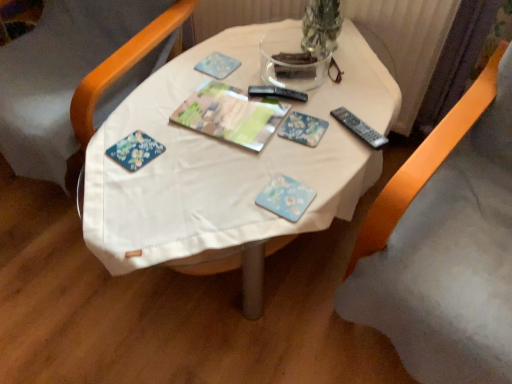
Where is `vacant area on the back side of blue floral coaster at center, which is the second paperback book from top to bottom`? This screenshot has height=384, width=512. vacant area on the back side of blue floral coaster at center, which is the second paperback book from top to bottom is located at coordinates (286, 154).